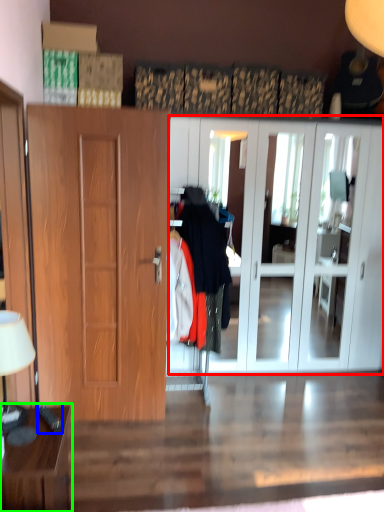
Question: Estimate the real-world distances between objects in this image. Which object is farther from cabinetry (highlighted by a red box), remote control (highlighted by a blue box) or table (highlighted by a green box)?

Choices:
 (A) remote control
 (B) table

Answer: (A)